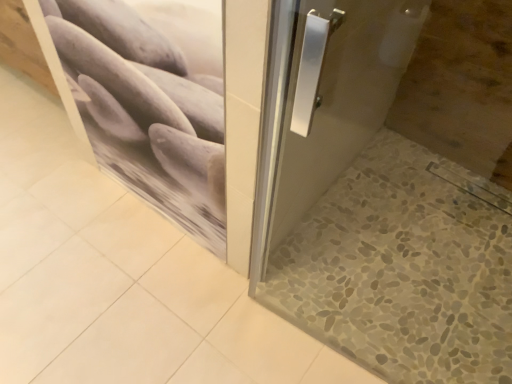
The width and height of the screenshot is (512, 384). What do you see at coordinates (174, 108) in the screenshot?
I see `matte stone pebble at upper left` at bounding box center [174, 108].

Find the location of `matte stone pebble at upper left`. matte stone pebble at upper left is located at coordinates (174, 108).

Describe the element at coordinates (403, 268) in the screenshot. This screenshot has height=384, width=512. I see `gray pebble tile at lower right` at that location.

Where is `gray pebble tile at lower right`? The width and height of the screenshot is (512, 384). gray pebble tile at lower right is located at coordinates (403, 268).

What is the approximate height of gray pebble tile at lower right?

A: gray pebble tile at lower right is 2.07 inches in height.

Where is `matte stone pebble at upper left`? This screenshot has height=384, width=512. matte stone pebble at upper left is located at coordinates (174, 108).

Looking at this image, is gray pebble tile at lower right to the right of matte stone pebble at upper left from the viewer's perspective?

Indeed, gray pebble tile at lower right is positioned on the right side of matte stone pebble at upper left.

Which object is closer to the camera taking this photo, gray pebble tile at lower right or matte stone pebble at upper left?

matte stone pebble at upper left is closer to the camera.

Which is in front, point (395, 328) or point (168, 85)?

The point (168, 85) is closer to the camera.

From the image's perspective, which one is positioned higher, gray pebble tile at lower right or matte stone pebble at upper left?

matte stone pebble at upper left, from the image's perspective.

From a real-world perspective, who is located higher, gray pebble tile at lower right or matte stone pebble at upper left?

In real-world perspective, matte stone pebble at upper left is above.

Consider the image. Considering the sizes of objects gray pebble tile at lower right and matte stone pebble at upper left in the image provided, who is wider, gray pebble tile at lower right or matte stone pebble at upper left?

Wider between the two is gray pebble tile at lower right.

Does gray pebble tile at lower right have a lesser height compared to matte stone pebble at upper left?

Correct, gray pebble tile at lower right is not as tall as matte stone pebble at upper left.

Is gray pebble tile at lower right bigger than matte stone pebble at upper left?

Yes.

Would you say gray pebble tile at lower right contains matte stone pebble at upper left?

No, matte stone pebble at upper left is not surrounded by gray pebble tile at lower right.

Is gray pebble tile at lower right next to matte stone pebble at upper left?

No, gray pebble tile at lower right is not touching matte stone pebble at upper left.

Does gray pebble tile at lower right turn towards matte stone pebble at upper left?

No, gray pebble tile at lower right is not aimed at matte stone pebble at upper left.

How many degrees apart are the facing directions of gray pebble tile at lower right and matte stone pebble at upper left?

They differ by 0.431 degrees in their facing directions.

How far apart are gray pebble tile at lower right and matte stone pebble at upper left?

gray pebble tile at lower right is 25.09 inches away from matte stone pebble at upper left.

This screenshot has width=512, height=384. What are the coordinates of `tile that is under the matte stone pebble at upper left (from a real-world perspective)` in the screenshot? It's located at (403, 268).

Considering the positions of objects matte stone pebble at upper left and gray pebble tile at lower right in the image provided, who is more to the left, matte stone pebble at upper left or gray pebble tile at lower right?

matte stone pebble at upper left.

Which is in front, matte stone pebble at upper left or gray pebble tile at lower right?

matte stone pebble at upper left.

Does point (109, 110) come farther from viewer compared to point (468, 343)?

No, it is in front of (468, 343).

From the image's perspective, which one is positioned lower, matte stone pebble at upper left or gray pebble tile at lower right?

gray pebble tile at lower right appears lower in the image.

From a real-world perspective, is matte stone pebble at upper left beneath gray pebble tile at lower right?

No, from a real-world perspective, matte stone pebble at upper left is not under gray pebble tile at lower right.

Is matte stone pebble at upper left wider than gray pebble tile at lower right?

No, matte stone pebble at upper left is not wider than gray pebble tile at lower right.

Considering the sizes of objects matte stone pebble at upper left and gray pebble tile at lower right in the image provided, who is shorter, matte stone pebble at upper left or gray pebble tile at lower right?

With less height is gray pebble tile at lower right.

Considering the relative sizes of matte stone pebble at upper left and gray pebble tile at lower right in the image provided, is matte stone pebble at upper left bigger than gray pebble tile at lower right?

No, matte stone pebble at upper left is not bigger than gray pebble tile at lower right.

Is matte stone pebble at upper left surrounding gray pebble tile at lower right?

No, gray pebble tile at lower right is located outside of matte stone pebble at upper left.

Is matte stone pebble at upper left beside gray pebble tile at lower right?

matte stone pebble at upper left is not next to gray pebble tile at lower right, and they're not touching.

From the picture: Is matte stone pebble at upper left turned away from gray pebble tile at lower right?

No, matte stone pebble at upper left is not facing away from gray pebble tile at lower right.

What's the angular difference between matte stone pebble at upper left and gray pebble tile at lower right's facing directions?

The angle between the facing direction of matte stone pebble at upper left and the facing direction of gray pebble tile at lower right is 0.431 degrees.

Locate an element on the screen. tile below the matte stone pebble at upper left (from the image's perspective) is located at coordinates (403, 268).

Identify the location of screen door to the left of gray pebble tile at lower right. (174, 108).

You are a GUI agent. You are given a task and a screenshot of the screen. Output one action in this format:
    pyautogui.click(x=<x>, y=<y>)
    Task: Click on the screen door above the gray pebble tile at lower right (from the image's perspective)
    The image size is (512, 384).
    Given the screenshot: What is the action you would take?
    pyautogui.click(x=174, y=108)